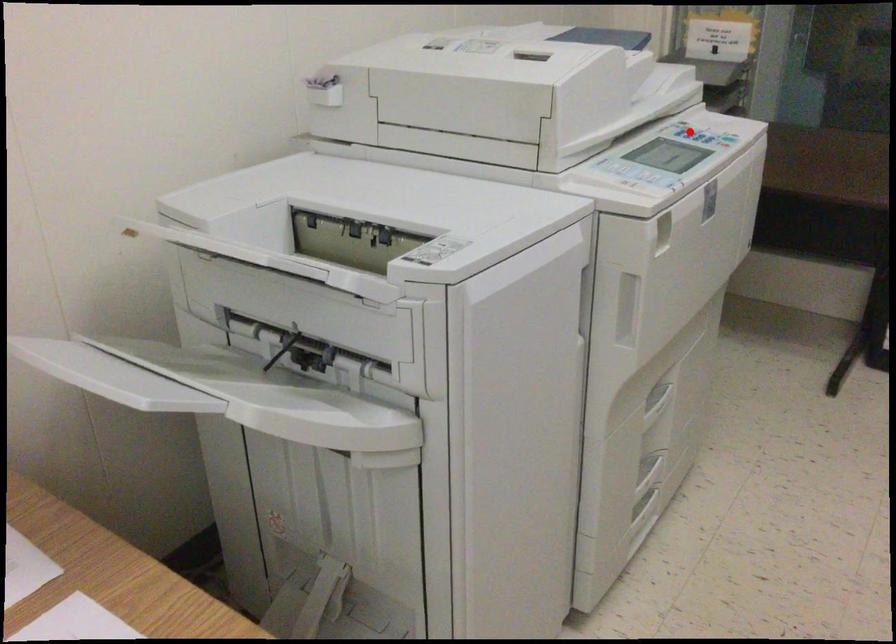
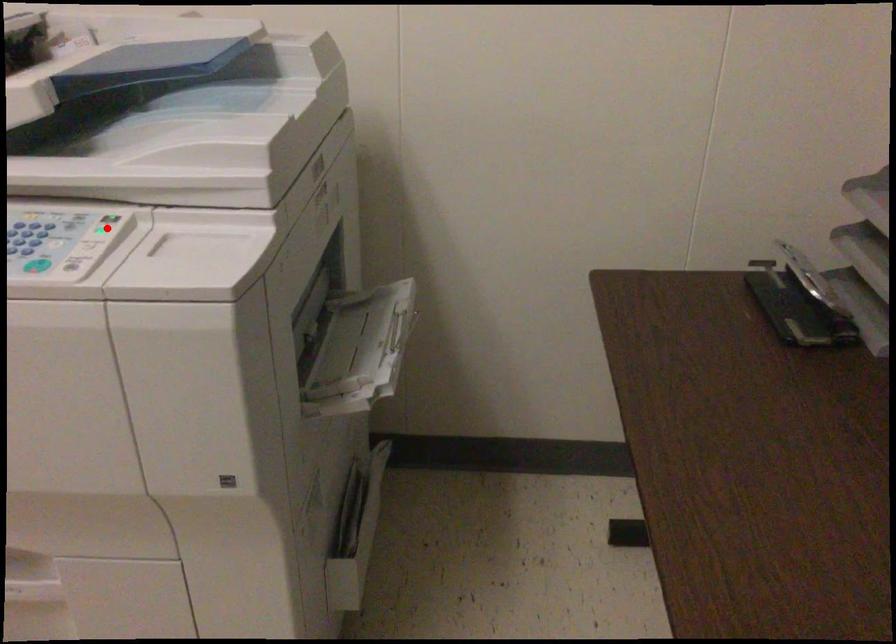
I am providing you with two images of the same scene from different viewpoints. A red point is marked on the first image and another point is marked on the second image. Do the highlighted points in image1 and image2 indicate the same real-world spot?

No